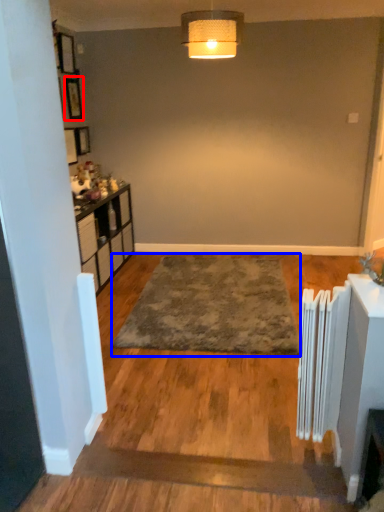
Question: Which point is further to the camera, picture frame (highlighted by a red box) or mat (highlighted by a blue box)?

Choices:
 (A) picture frame
 (B) mat

Answer: (A)